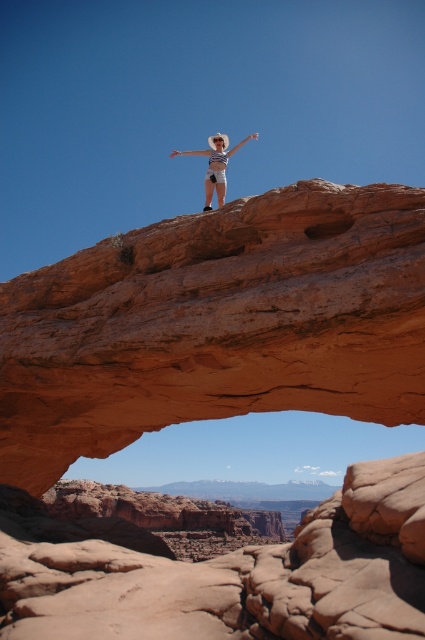
Question: Which object appears closest to the camera in this image?

Choices:
 (A) matte white hat at center
 (B) rustic sandstone arch at center

Answer: (B)

Question: Observing the image, what is the correct spatial positioning of rustic sandstone arch at center in reference to matte white hat at center?

Choices:
 (A) below
 (B) above

Answer: (A)

Question: Is rustic sandstone arch at center to the right of matte white hat at center from the viewer's perspective?

Choices:
 (A) yes
 (B) no

Answer: (B)

Question: Which object is farther from the camera taking this photo?

Choices:
 (A) matte white hat at center
 (B) rustic sandstone arch at center

Answer: (A)

Question: Does rustic sandstone arch at center appear under matte white hat at center?

Choices:
 (A) no
 (B) yes

Answer: (B)